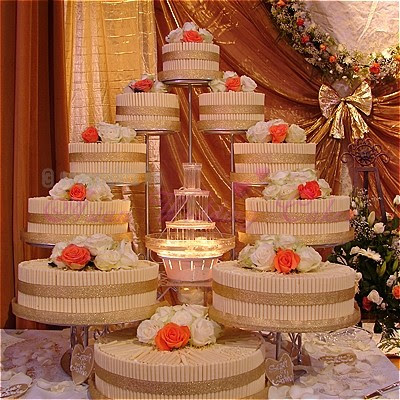
Locate an element on the screen. The width and height of the screenshot is (400, 400). white floor is located at coordinates (333, 371), (45, 372).